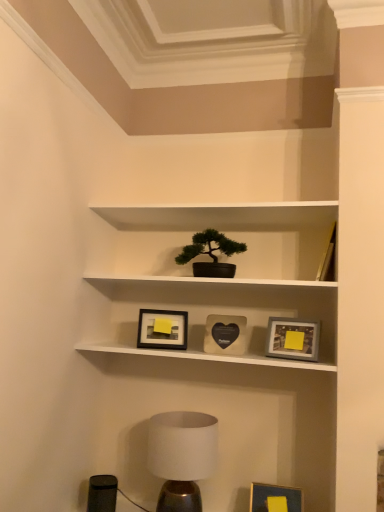
This screenshot has width=384, height=512. In order to click on free space above white matte shelf at center (from a real-world perspective) in this screenshot , I will do `click(223, 212)`.